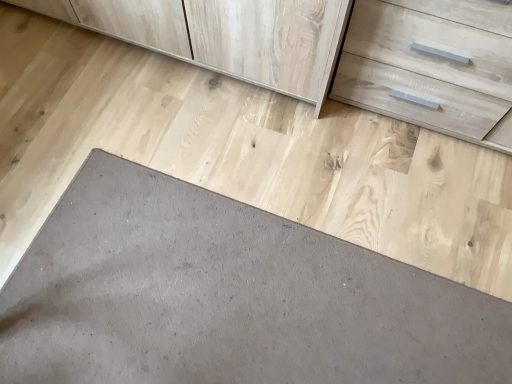
Question: Considering the positions of light wood drawer at upper right and gray matte slate at lower left in the image, is light wood drawer at upper right bigger or smaller than gray matte slate at lower left?

Choices:
 (A) small
 (B) big

Answer: (B)

Question: From the image's perspective, is light wood drawer at upper right above or below gray matte slate at lower left?

Choices:
 (A) below
 (B) above

Answer: (B)

Question: Does point (386, 107) appear closer or farther from the camera than point (248, 350)?

Choices:
 (A) farther
 (B) closer

Answer: (A)

Question: Is point (334, 263) positioned closer to the camera than point (388, 74)?

Choices:
 (A) farther
 (B) closer

Answer: (B)

Question: Is gray matte slate at lower left wider or thinner than light wood drawer at upper right?

Choices:
 (A) wide
 (B) thin

Answer: (A)

Question: Choose the correct answer: Is gray matte slate at lower left inside light wood drawer at upper right or outside it?

Choices:
 (A) outside
 (B) inside

Answer: (A)

Question: From the image's perspective, relative to light wood drawer at upper right, is gray matte slate at lower left above or below?

Choices:
 (A) above
 (B) below

Answer: (B)